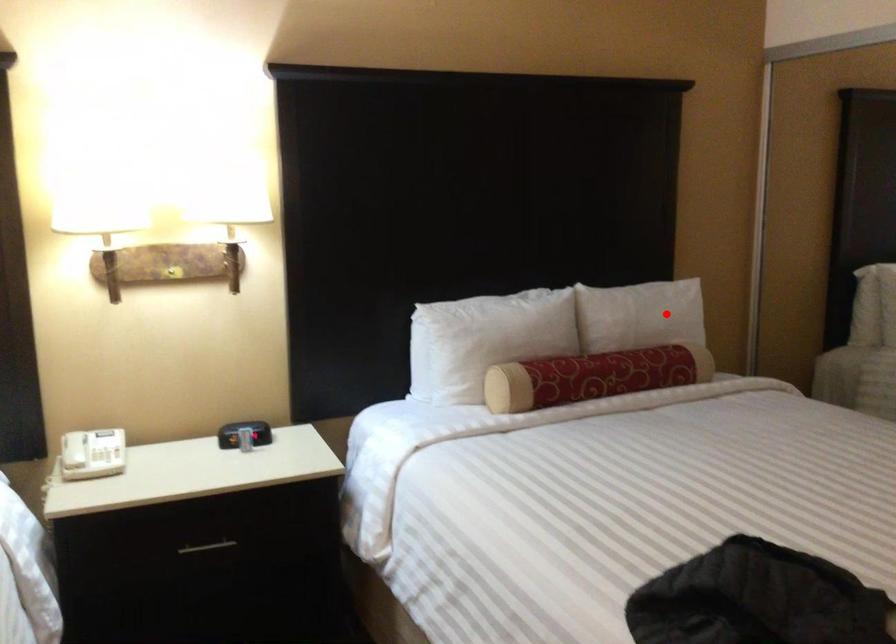
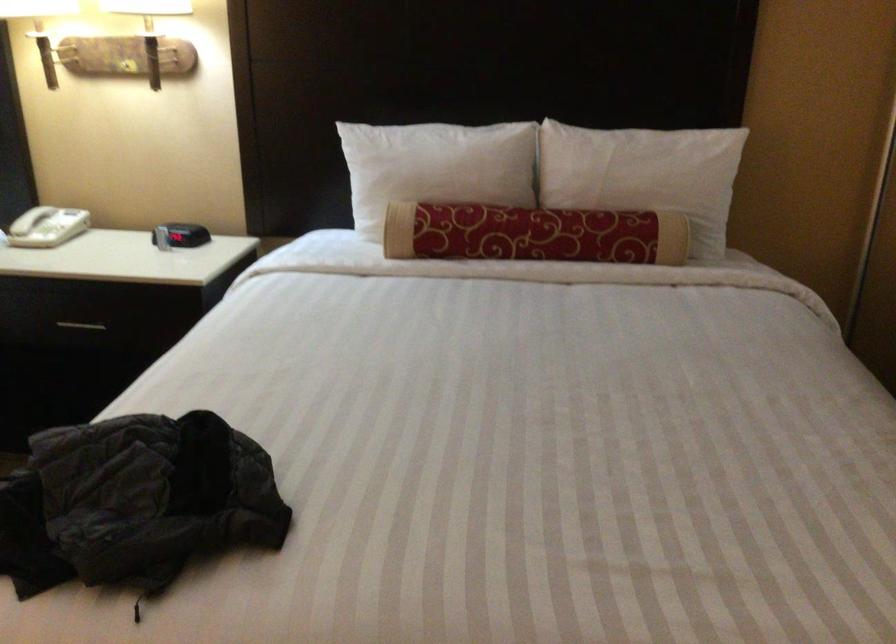
Question: I am providing you with two images of the same scene from different viewpoints. In image1, a red point is highlighted. Considering the same 3D point in image2, which of the following is correct?

Choices:
 (A) It is closer
 (B) It is farther

Answer: (A)